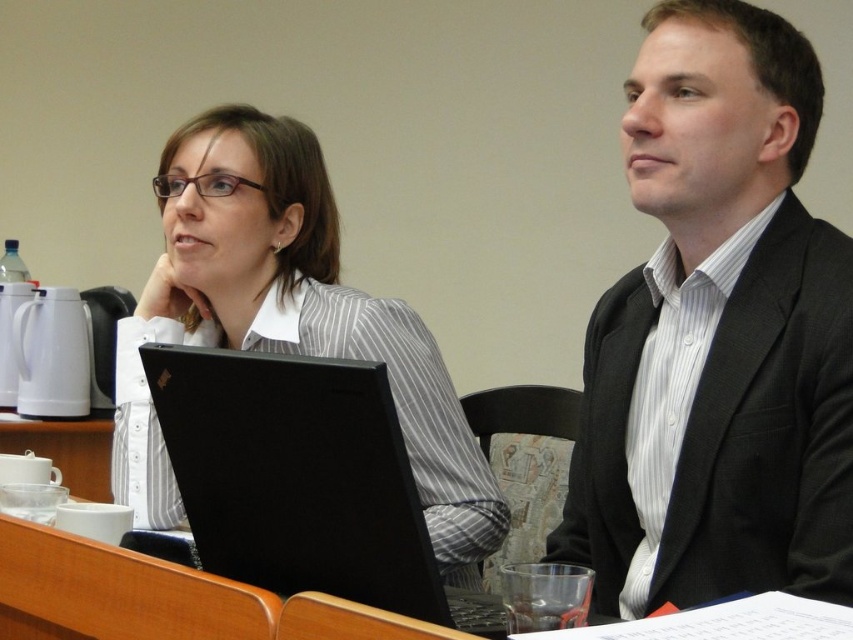
Question: Which object appears farthest from the camera in this image?

Choices:
 (A) black textured suit at center
 (B) black matte laptop at center
 (C) white striped shirt at center

Answer: (C)

Question: Estimate the real-world distances between objects in this image. Which object is closer to the white striped shirt at center?

Choices:
 (A) black textured suit at center
 (B) black matte laptop at center

Answer: (B)

Question: In this image, where is white striped shirt at center located relative to black matte laptop at center?

Choices:
 (A) right
 (B) left

Answer: (B)

Question: In this image, where is white striped shirt at center located relative to black matte laptop at center?

Choices:
 (A) above
 (B) below

Answer: (A)

Question: Considering the real-world distances, which object is closest to the black matte laptop at center?

Choices:
 (A) white striped shirt at center
 (B) black textured suit at center

Answer: (A)

Question: Does black textured suit at center lie in front of black matte laptop at center?

Choices:
 (A) yes
 (B) no

Answer: (B)